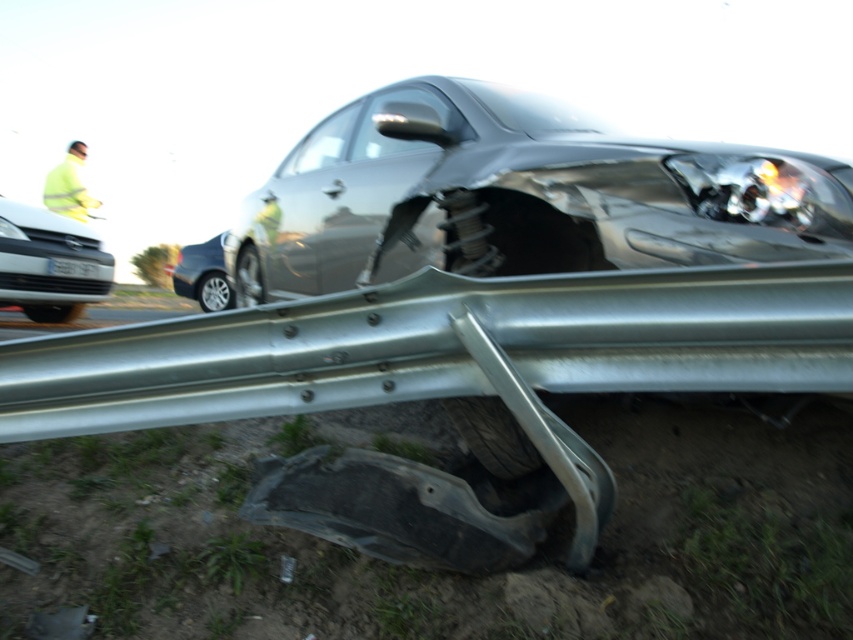
You are a GUI agent. You are given a task and a screenshot of the screen. Output one action in this format:
    pyautogui.click(x=<x>, y=<y>)
    Task: Click on the satin silver car at center
    
    Given the screenshot: What is the action you would take?
    pyautogui.click(x=518, y=195)

Can you confirm if satin silver car at center is shorter than shiny metallic sedan at center?

No.

You are a GUI agent. You are given a task and a screenshot of the screen. Output one action in this format:
    pyautogui.click(x=<x>, y=<y>)
    Task: Click on the satin silver car at center
    The width and height of the screenshot is (853, 640).
    Given the screenshot: What is the action you would take?
    pyautogui.click(x=518, y=195)

Is shiny metallic sedan at center positioned in front of high visibility yellow jacket at upper left?

No.

Who is positioned more to the left, shiny metallic sedan at center or high visibility yellow jacket at upper left?

From the viewer's perspective, high visibility yellow jacket at upper left appears more on the left side.

The height and width of the screenshot is (640, 853). I want to click on shiny metallic sedan at center, so click(x=202, y=275).

Between satin silver car at center and high visibility yellow jacket at upper left, which one has less height?

Standing shorter between the two is satin silver car at center.

Who is more distant from viewer, (576, 172) or (45, 179)?

Positioned behind is point (45, 179).

You are a GUI agent. You are given a task and a screenshot of the screen. Output one action in this format:
    pyautogui.click(x=<x>, y=<y>)
    Task: Click on the satin silver car at center
    
    Given the screenshot: What is the action you would take?
    pyautogui.click(x=518, y=195)

Locate an element on the screen. The height and width of the screenshot is (640, 853). satin silver car at center is located at coordinates (518, 195).